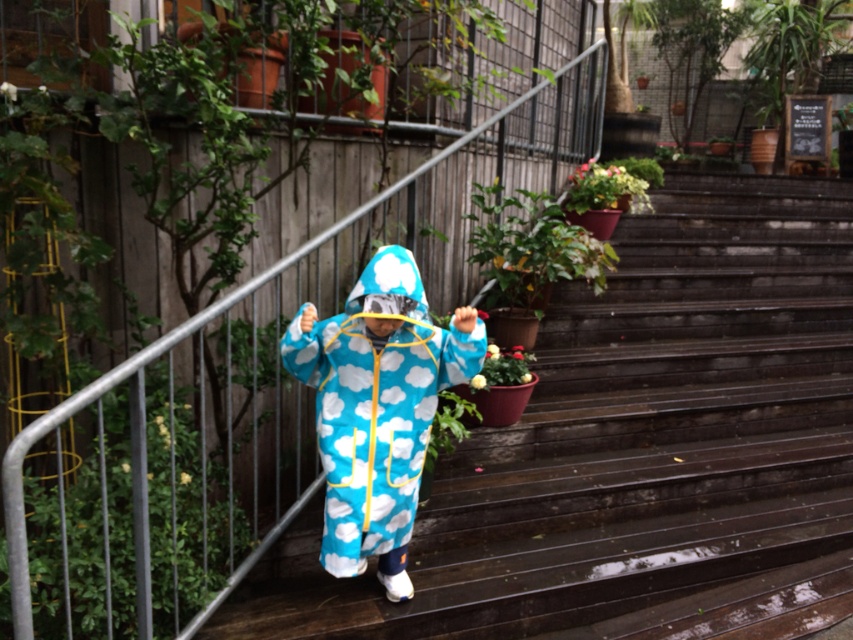
Question: Can you confirm if green matte plant at center is positioned to the left of green matte flower pot at upper center?

Choices:
 (A) no
 (B) yes

Answer: (B)

Question: Is the position of green matte plant at center more distant than that of green matte flower pot at center?

Choices:
 (A) no
 (B) yes

Answer: (B)

Question: Which point appears farthest from the camera in this image?

Choices:
 (A) (608, 195)
 (B) (407, 291)
 (C) (500, 232)

Answer: (A)

Question: Which of these objects is positioned closest to the blue cloud-patterned jumpsuit at center?

Choices:
 (A) green leafy plant at upper center
 (B) green matte plant at center
 (C) green matte flower pot at upper center
 (D) green matte flower pot at center

Answer: (D)

Question: Does green matte flower pot at upper center have a smaller size compared to green matte flower pot at center?

Choices:
 (A) yes
 (B) no

Answer: (B)

Question: Which object is farther from the camera taking this photo?

Choices:
 (A) green matte plant at center
 (B) green matte flower pot at center
 (C) wooden stairs at center
 (D) green leafy plant at upper center

Answer: (D)